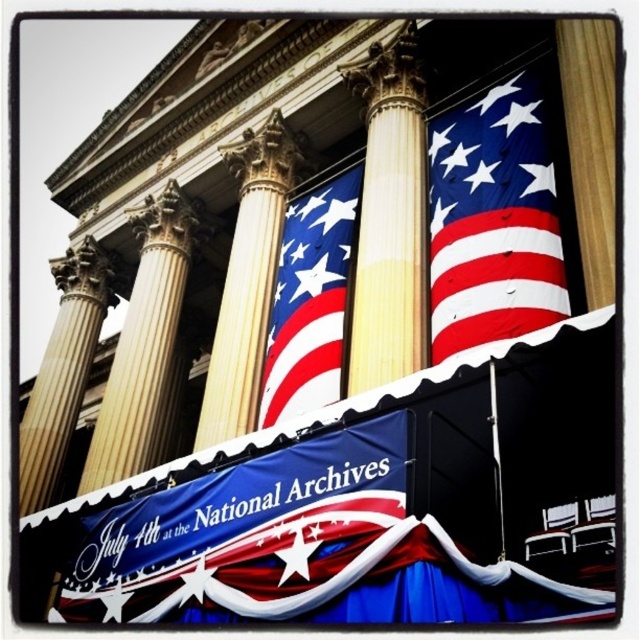
Question: Which object appears farthest from the camera in this image?

Choices:
 (A) golden marble pillar at left
 (B) smooth cream-colored column at center
 (C) matte fabric flag at center
 (D) polyester american flag at upper right

Answer: (A)

Question: Is blue fabric banner at center above smooth cream-colored column at center?

Choices:
 (A) yes
 (B) no

Answer: (B)

Question: Among these objects, which one is nearest to the camera?

Choices:
 (A) blue fabric banner at center
 (B) gold metallic pole at center
 (C) wooden column at center

Answer: (A)

Question: Among these objects, which one is farthest from the camera?

Choices:
 (A) golden polished column at center
 (B) wooden column at center
 (C) matte fabric flag at center

Answer: (C)

Question: Is beige marble column at center positioned before wooden column at center?

Choices:
 (A) no
 (B) yes

Answer: (A)

Question: Can you confirm if polyester american flag at upper right is positioned above beige marble column at center?

Choices:
 (A) yes
 (B) no

Answer: (A)